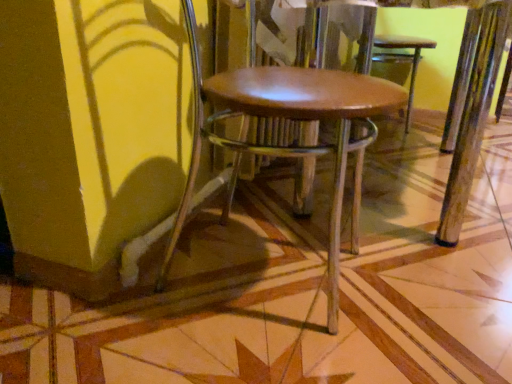
Question: Should I look upward or downward to see brown leather chair at center?

Choices:
 (A) up
 (B) down

Answer: (A)